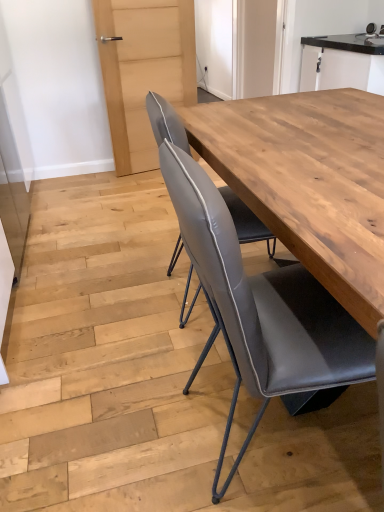
Question: Is natural wood table at center facing towards matte gray leather chair at center?

Choices:
 (A) yes
 (B) no

Answer: (B)

Question: Is natural wood table at center not within matte gray leather chair at center?

Choices:
 (A) yes
 (B) no

Answer: (A)

Question: Does natural wood table at center have a smaller size compared to matte gray leather chair at center?

Choices:
 (A) yes
 (B) no

Answer: (A)

Question: Is natural wood table at center next to matte gray leather chair at center?

Choices:
 (A) yes
 (B) no

Answer: (B)

Question: From a real-world perspective, is natural wood table at center on top of matte gray leather chair at center?

Choices:
 (A) no
 (B) yes

Answer: (A)

Question: Does natural wood table at center have a greater width compared to matte gray leather chair at center?

Choices:
 (A) yes
 (B) no

Answer: (A)

Question: From a real-world perspective, does matte gray leather chair at center sit lower than natural wood table at center?

Choices:
 (A) no
 (B) yes

Answer: (A)

Question: Considering the relative sizes of matte gray leather chair at center and natural wood table at center in the image provided, is matte gray leather chair at center bigger than natural wood table at center?

Choices:
 (A) yes
 (B) no

Answer: (A)

Question: Can you confirm if matte gray leather chair at center is smaller than natural wood table at center?

Choices:
 (A) no
 (B) yes

Answer: (A)

Question: Would you say matte gray leather chair at center is outside natural wood table at center?

Choices:
 (A) yes
 (B) no

Answer: (A)

Question: From the image's perspective, is matte gray leather chair at center under natural wood table at center?

Choices:
 (A) yes
 (B) no

Answer: (A)

Question: Can natural wood table at center be found inside matte gray leather chair at center?

Choices:
 (A) no
 (B) yes

Answer: (A)

Question: Can you confirm if matte gray leather chair at center is wider than black glossy cabinet at upper right?

Choices:
 (A) yes
 (B) no

Answer: (A)